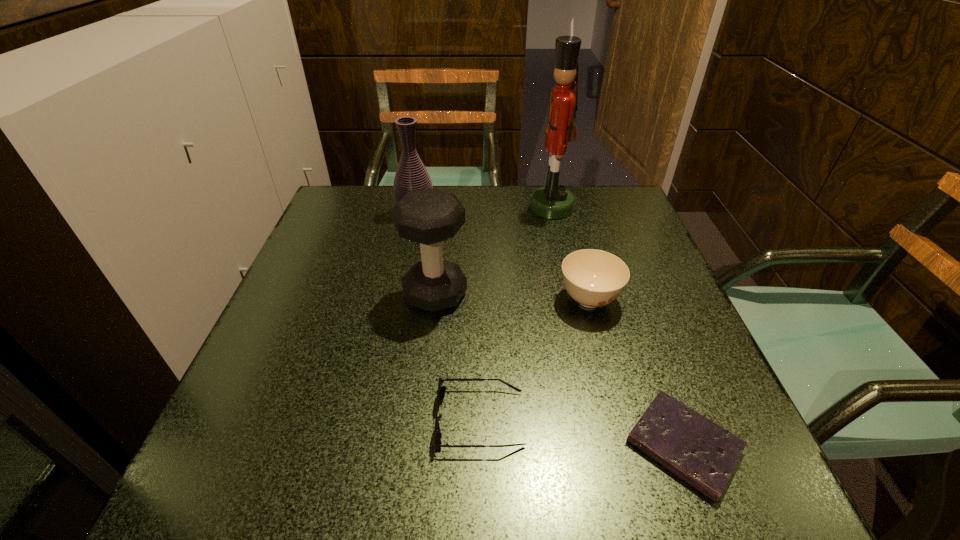
Locate an element on the screen. The width and height of the screenshot is (960, 540). free spot at the near left corner of the desktop is located at coordinates (304, 462).

In the image, there is a desktop. Where is `vacant area at the far right corner`? vacant area at the far right corner is located at coordinates (626, 193).

In the image, there is a desktop. Find the location of `blank space at the near right corner`. blank space at the near right corner is located at coordinates pyautogui.click(x=746, y=498).

The width and height of the screenshot is (960, 540). I want to click on vacant space that is in between the nutcracker and the vase, so click(484, 210).

At what (x,y) coordinates should I click in order to perform the action: click on free space between the sugar bowl and the vase. Please return your answer as a coordinate pair (x, y). This screenshot has width=960, height=540. Looking at the image, I should click on (502, 256).

Identify the location of free space between the third shortest object and the shortest object. (636, 373).

Identify the location of vacant point located between the vase and the sugar bowl. This screenshot has height=540, width=960. (502, 256).

Find the location of `vacant space that's between the shortest object and the vase`. vacant space that's between the shortest object and the vase is located at coordinates (549, 329).

The height and width of the screenshot is (540, 960). Find the location of `vacant point located between the dumbbell and the sunglasses`. vacant point located between the dumbbell and the sunglasses is located at coordinates (458, 356).

Identify the location of vacant region between the sunglasses and the diary. (582, 432).